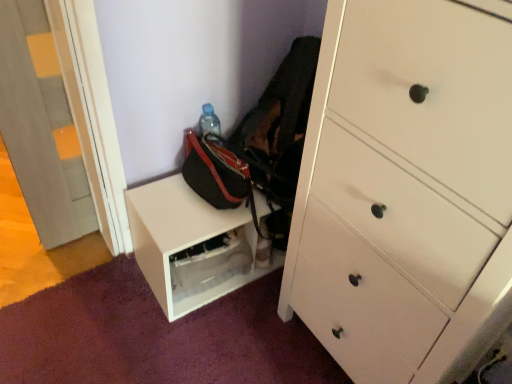
You are a GUI agent. You are given a task and a screenshot of the screen. Output one action in this format:
    pyautogui.click(x=<x>, y=<y>)
    Task: Click on the free space to the left of white matte shelf at lower center
    The image size is (512, 384).
    Given the screenshot: What is the action you would take?
    pyautogui.click(x=131, y=300)